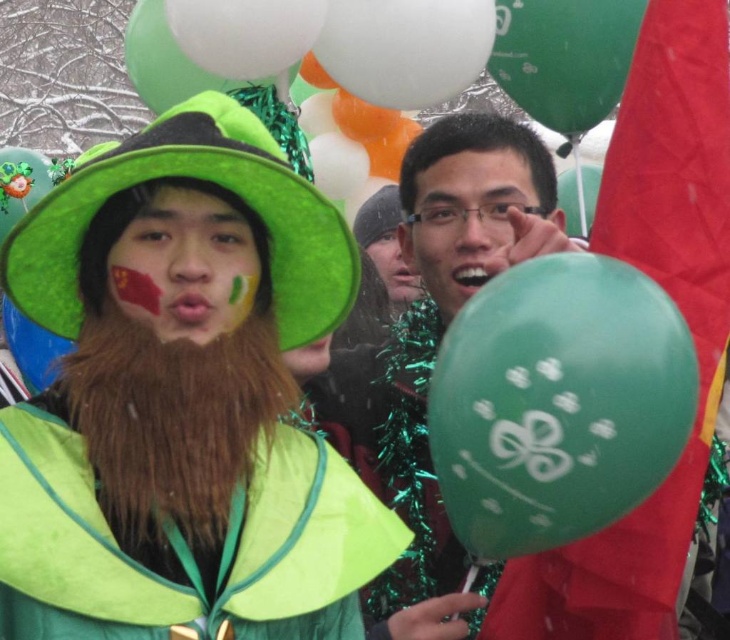
Does glossy plastic balloon at center appear under brown fuzzy beard at center?

Yes.

Is glossy plastic balloon at center above brown fuzzy beard at center?

No, glossy plastic balloon at center is not above brown fuzzy beard at center.

Is point (487, 195) positioned before point (172, 493)?

No.

Identify the location of glossy plastic balloon at center. The width and height of the screenshot is (730, 640). (434, 340).

From the picture: Between green glossy balloon at center and matte green hat at center, which one appears on the right side from the viewer's perspective?

green glossy balloon at center is more to the right.

Does green glossy balloon at center appear on the left side of matte green hat at center?

In fact, green glossy balloon at center is to the right of matte green hat at center.

Between point (468, 435) and point (237, 268), which one is positioned behind?

Point (237, 268)

At what (x,y) coordinates should I click in order to perform the action: click on green glossy balloon at center. Please return your answer as a coordinate pair (x, y). This screenshot has height=640, width=730. Looking at the image, I should click on (557, 403).

This screenshot has width=730, height=640. What do you see at coordinates (557, 403) in the screenshot?
I see `green glossy balloon at center` at bounding box center [557, 403].

Is green glossy balloon at center to the right of matte green balloon at center from the viewer's perspective?

Correct, you'll find green glossy balloon at center to the right of matte green balloon at center.

This screenshot has height=640, width=730. What do you see at coordinates (557, 403) in the screenshot? I see `green glossy balloon at center` at bounding box center [557, 403].

Where is `green glossy balloon at center`? The image size is (730, 640). green glossy balloon at center is located at coordinates (557, 403).